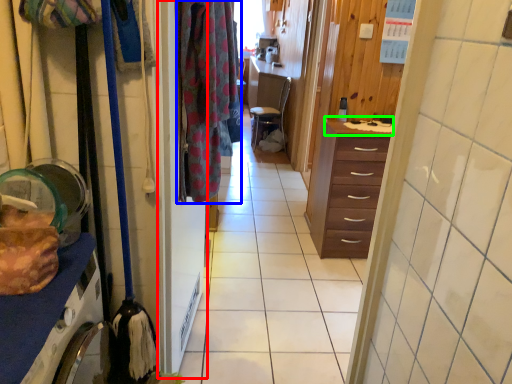
Question: Estimate the real-world distances between objects in this image. Which object is closer to screen door (highlighted by a red box), clothing (highlighted by a blue box) or counter top (highlighted by a green box)?

Choices:
 (A) clothing
 (B) counter top

Answer: (A)